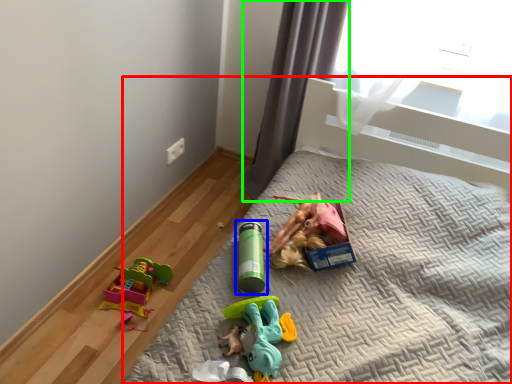
Question: Which object is positioned farthest from bed (highlighted by a red box)? Select from toy (highlighted by a blue box) and curtain (highlighted by a green box).

Choices:
 (A) toy
 (B) curtain

Answer: (B)